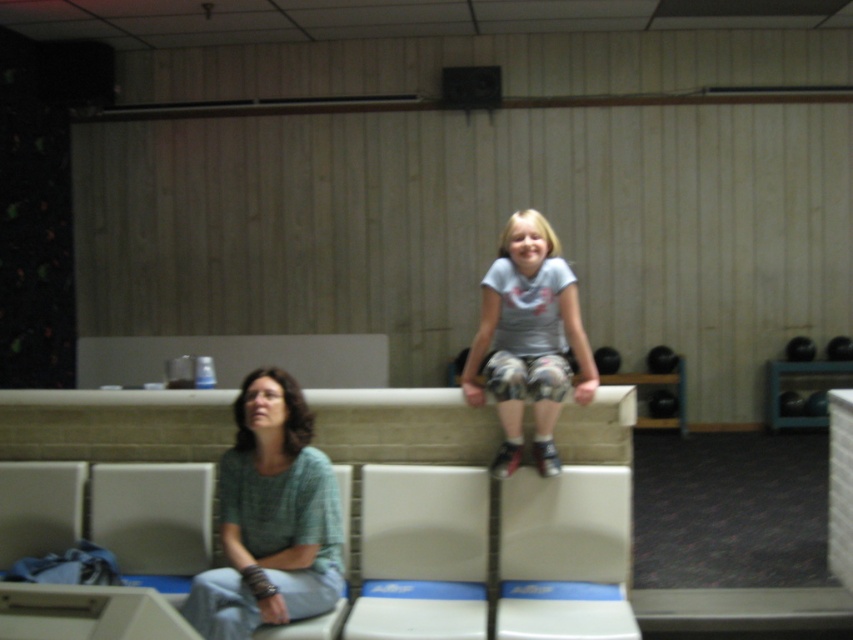
Which is more to the left, green woven shirt at center or gray cotton shirt at center?

Positioned to the left is green woven shirt at center.

Image resolution: width=853 pixels, height=640 pixels. Describe the element at coordinates (271, 518) in the screenshot. I see `green woven shirt at center` at that location.

The image size is (853, 640). In order to click on green woven shirt at center in this screenshot , I will do `click(271, 518)`.

Where is `green woven shirt at center`? This screenshot has width=853, height=640. green woven shirt at center is located at coordinates (271, 518).

How much distance is there between wooden bench at upper center and gray cotton shirt at center?

They are 9.74 inches apart.

Where is `wooden bench at upper center`? This screenshot has height=640, width=853. wooden bench at upper center is located at coordinates (114, 424).

Find the location of a particular element. wooden bench at upper center is located at coordinates (114, 424).

Who is shorter, wooden bench at upper center or green woven shirt at center?

With less height is wooden bench at upper center.

Between point (47, 388) and point (260, 465), which one is positioned behind?

Positioned behind is point (47, 388).

Identify the location of wooden bench at upper center. Image resolution: width=853 pixels, height=640 pixels. (114, 424).